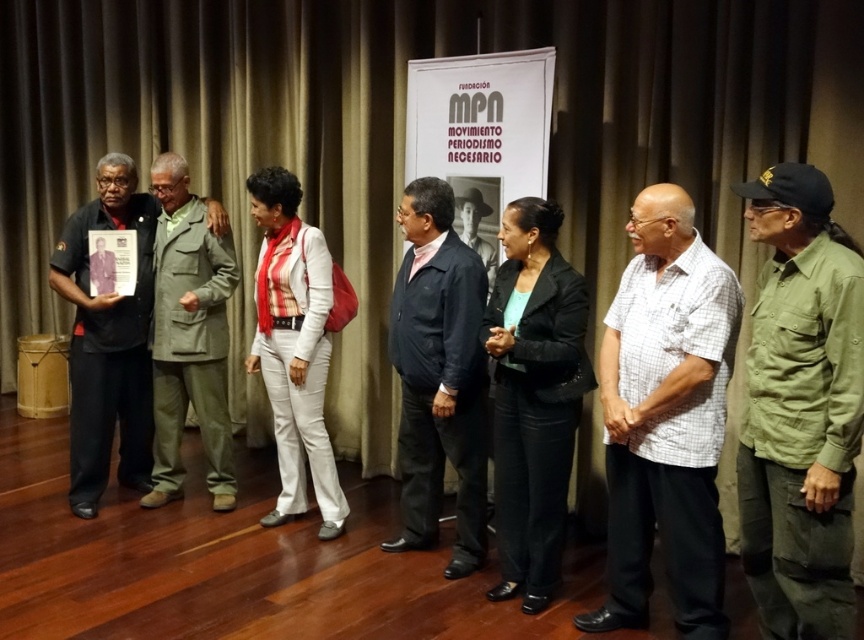
Question: Can you confirm if green canvas shirt at right is smaller than black matte blazer at center?

Choices:
 (A) yes
 (B) no

Answer: (B)

Question: Is white checkered shirt at center positioned behind black matte blazer at center?

Choices:
 (A) no
 (B) yes

Answer: (A)

Question: Based on their relative distances, which object is nearer to the matte black photo at left?

Choices:
 (A) dark blue jacket at center
 (B) green canvas shirt at right

Answer: (A)

Question: Which object is farther from the camera taking this photo?

Choices:
 (A) matte white pants at center
 (B) khaki fabric suit at center
 (C) white checkered shirt at center
 (D) green canvas shirt at right

Answer: (B)

Question: Which of the following is the farthest from the observer?

Choices:
 (A) khaki fabric suit at center
 (B) matte white pants at center
 (C) black matte blazer at center
 (D) white checkered shirt at center

Answer: (A)

Question: Does green canvas shirt at right have a greater width compared to dark blue jacket at center?

Choices:
 (A) no
 (B) yes

Answer: (A)